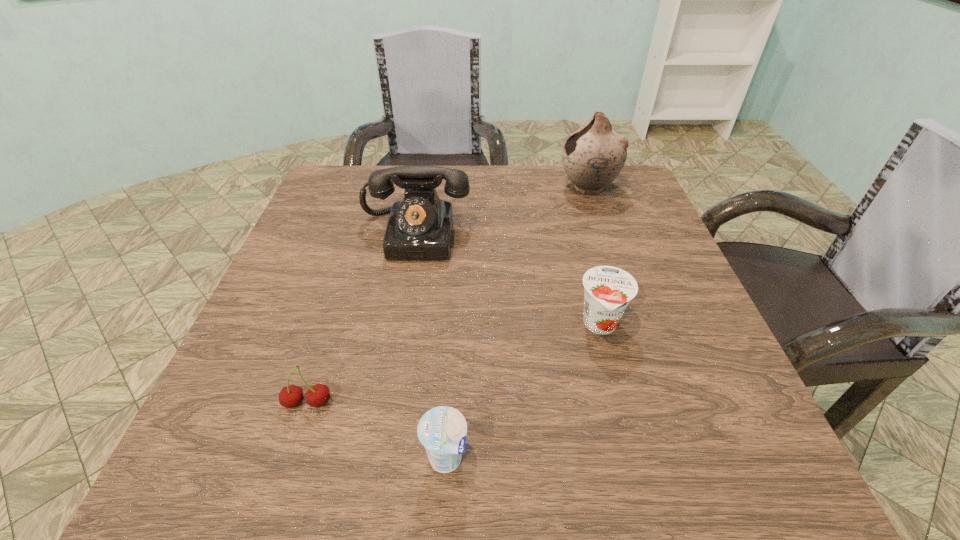
Image resolution: width=960 pixels, height=540 pixels. In order to click on vacant space situated 0.290m from the spout of the pottery in this screenshot , I will do `click(449, 188)`.

Where is `vacant area situated 0.200m from the spout of the pottery`? The width and height of the screenshot is (960, 540). vacant area situated 0.200m from the spout of the pottery is located at coordinates (483, 188).

Where is `free region located 0.170m on the dial of the second tallest object`? The width and height of the screenshot is (960, 540). free region located 0.170m on the dial of the second tallest object is located at coordinates (399, 323).

Locate an element on the screen. blank space located on the left of the right yogurt is located at coordinates (490, 325).

Find the location of a particular element. The height and width of the screenshot is (540, 960). free space located on the surface of the cherry is located at coordinates (288, 464).

Locate an element on the screen. Image resolution: width=960 pixels, height=540 pixels. free space located 0.310m on the left of the left yogurt is located at coordinates (208, 458).

You are a GUI agent. You are given a task and a screenshot of the screen. Output one action in this format:
    pyautogui.click(x=<x>, y=<y>)
    Task: Click on the pottery situated at the far edge
    This screenshot has height=540, width=960.
    Given the screenshot: What is the action you would take?
    pyautogui.click(x=593, y=156)

Identify the location of telephone positioned at the far edge. The image size is (960, 540). (419, 227).

Locate an element on the screen. object that is at the near edge is located at coordinates (442, 430).

This screenshot has width=960, height=540. I want to click on telephone that is positioned at the left edge, so click(x=419, y=227).